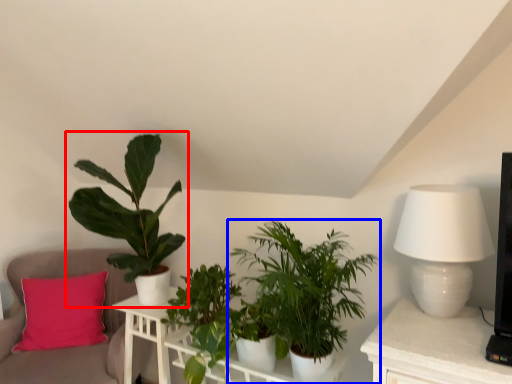
Question: Which of the following is the farthest to the observer, houseplant (highlighted by a red box) or houseplant (highlighted by a blue box)?

Choices:
 (A) houseplant
 (B) houseplant

Answer: (A)